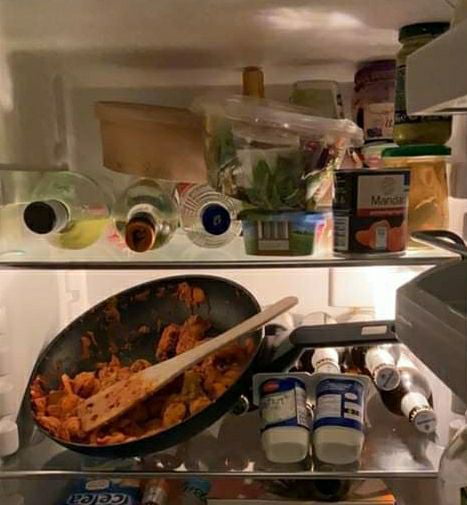
This screenshot has height=505, width=467. I want to click on bottom shelf, so click(127, 494).